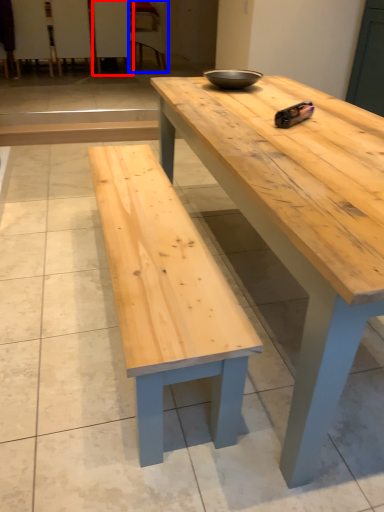
Question: Which of the following is the closest to the observer, chair (highlighted by a red box) or chair (highlighted by a blue box)?

Choices:
 (A) chair
 (B) chair

Answer: (A)